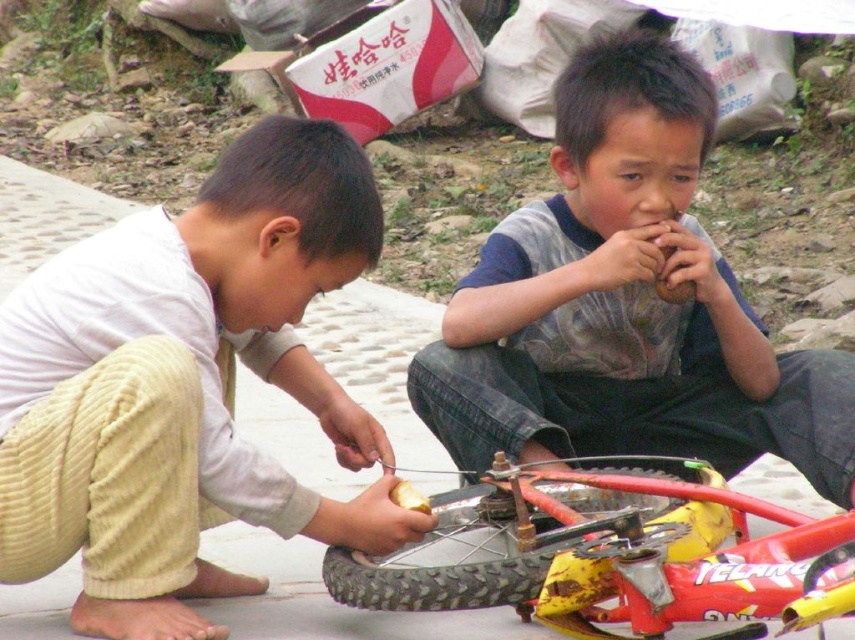
Question: Can you confirm if white matte shirt at lower left is thinner than yellow rubber tire at lower center?

Choices:
 (A) yes
 (B) no

Answer: (B)

Question: Does white matte shirt at lower left appear on the right side of yellow rubber tire at lower center?

Choices:
 (A) yes
 (B) no

Answer: (B)

Question: Among these points, which one is nearest to the camera?

Choices:
 (A) (441, 568)
 (B) (316, 532)

Answer: (A)

Question: Does white matte shirt at lower left have a smaller size compared to gray cotton shirt at center?

Choices:
 (A) yes
 (B) no

Answer: (A)

Question: Which point is farther from the camera taking this photo?

Choices:
 (A) (505, 374)
 (B) (30, 513)
 (C) (472, 497)

Answer: (A)

Question: Estimate the real-world distances between objects in this image. Which object is farther from the yellow rubber tire at lower center?

Choices:
 (A) white matte shirt at lower left
 (B) gray cotton shirt at center

Answer: (A)